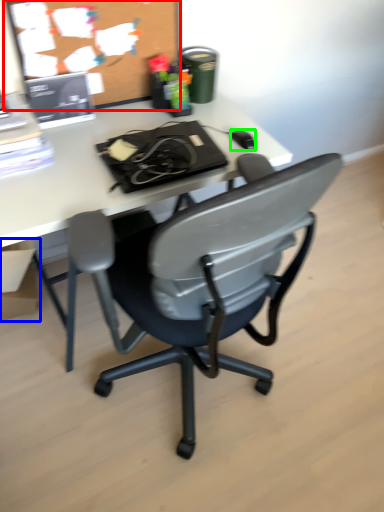
Question: Which is nearer to the bulletin board (highlighted by a red box)? box (highlighted by a blue box) or mouse (highlighted by a green box).

Choices:
 (A) box
 (B) mouse

Answer: (B)